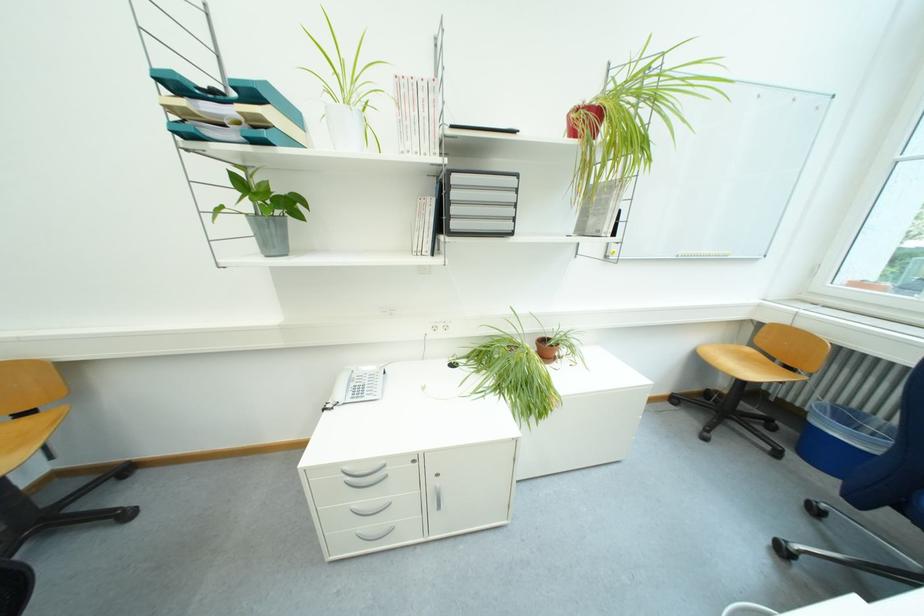
Where would you pull the silver cabinet handle? Please return your answer as a coordinate pair (x, y).

(370, 508)